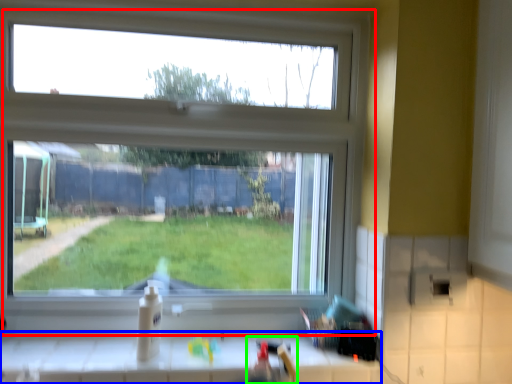
Question: Which object is the farthest from window (highlighted by a red box)? Choose among these: counter (highlighted by a blue box) or sink (highlighted by a green box).

Choices:
 (A) counter
 (B) sink

Answer: (B)